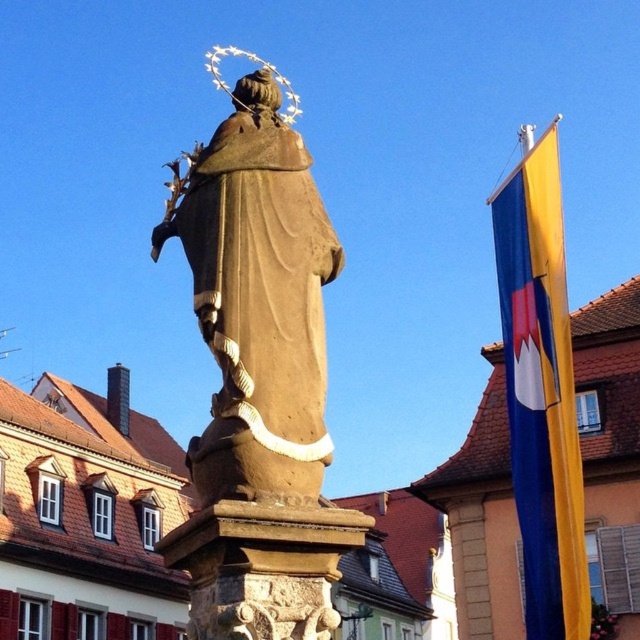
Question: Can you confirm if brown stone statue at center is smaller than yellow fabric flag at right?

Choices:
 (A) yes
 (B) no

Answer: (A)

Question: Which point is farther to the camera?

Choices:
 (A) brown stone statue at center
 (B) yellow fabric flag at right

Answer: (B)

Question: Considering the relative positions of brown stone statue at center and yellow fabric flag at right in the image provided, where is brown stone statue at center located with respect to yellow fabric flag at right?

Choices:
 (A) right
 (B) left

Answer: (B)

Question: Which point appears farthest from the camera in this image?

Choices:
 (A) (289, 280)
 (B) (531, 317)

Answer: (B)

Question: From the image, what is the correct spatial relationship of brown stone statue at center in relation to yellow fabric flag at right?

Choices:
 (A) above
 (B) below

Answer: (B)

Question: Among these objects, which one is nearest to the camera?

Choices:
 (A) brown stone statue at center
 (B) yellow fabric flag at right

Answer: (A)